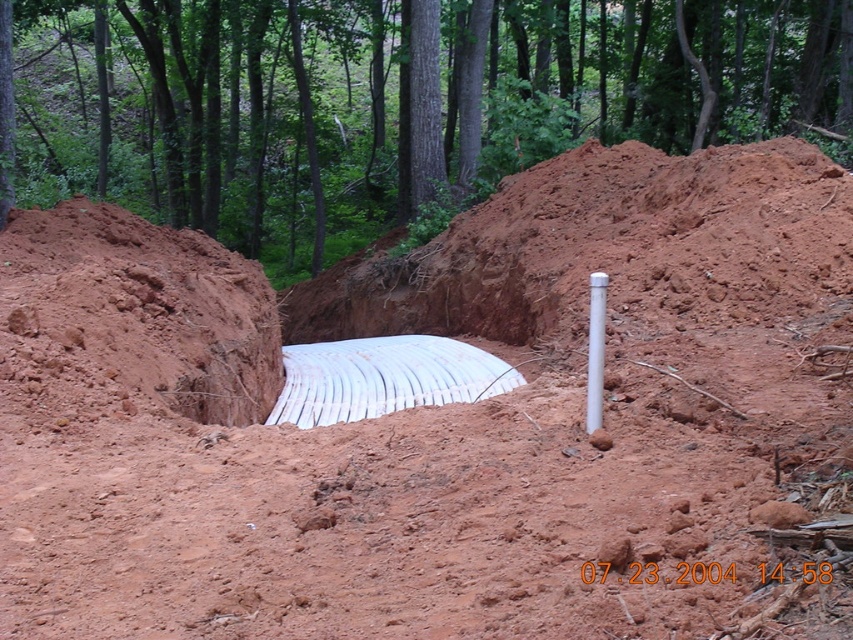
Does reddish-brown clay mound at center-left have a larger size compared to white plastic pole at center?

Yes, reddish-brown clay mound at center-left is bigger than white plastic pole at center.

Can you confirm if reddish-brown clay mound at center-left is positioned to the left of white plastic pole at center?

Indeed, reddish-brown clay mound at center-left is positioned on the left side of white plastic pole at center.

Describe the element at coordinates (132, 317) in the screenshot. This screenshot has height=640, width=853. I see `reddish-brown clay mound at center-left` at that location.

The height and width of the screenshot is (640, 853). In order to click on reddish-brown clay mound at center-left in this screenshot , I will do `click(132, 317)`.